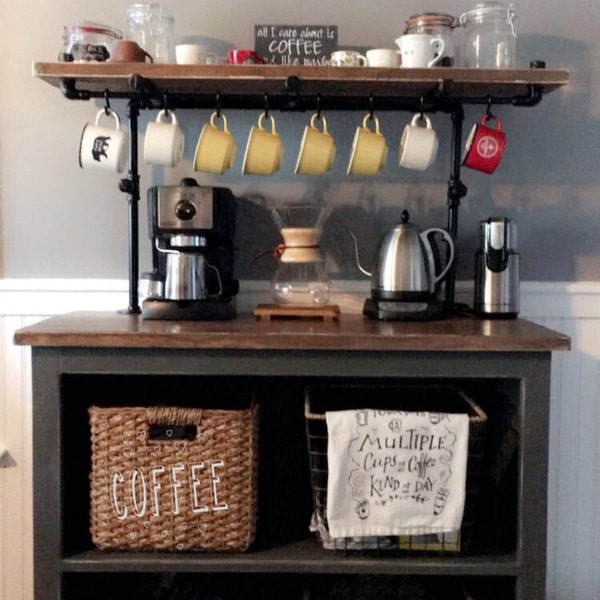
At what (x,y) coordinates should I click in order to perform the action: click on handle to hold kettle. Please return your answer as a coordinate pair (x, y). This screenshot has height=600, width=600. Looking at the image, I should click on (452, 255).